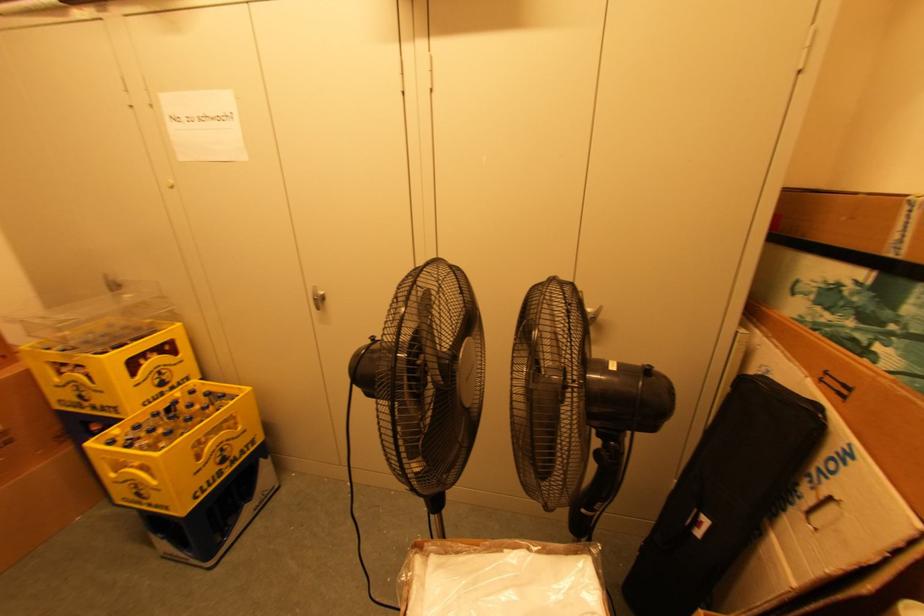
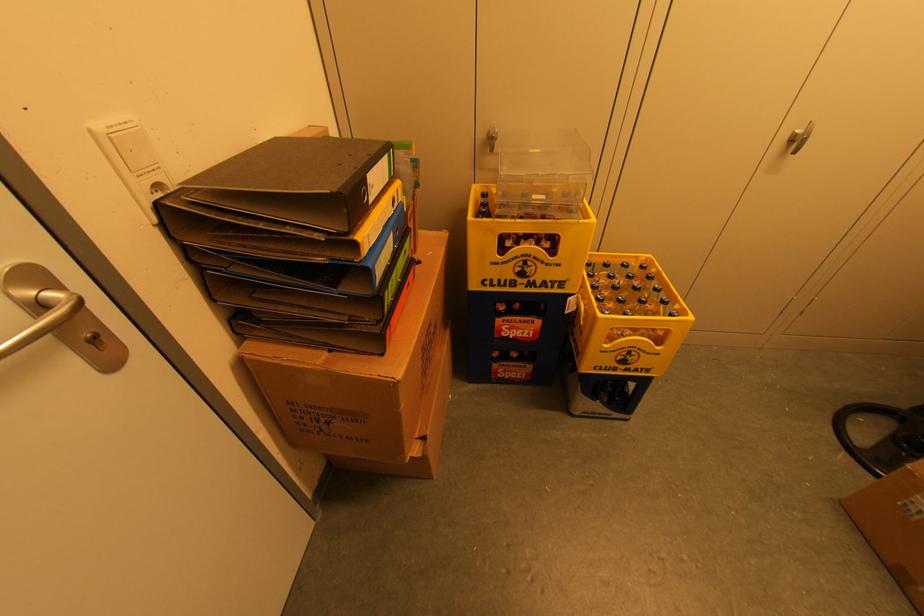
Locate, in the second image, the point that corresponds to the point at 322,302 in the first image.

(798, 142)